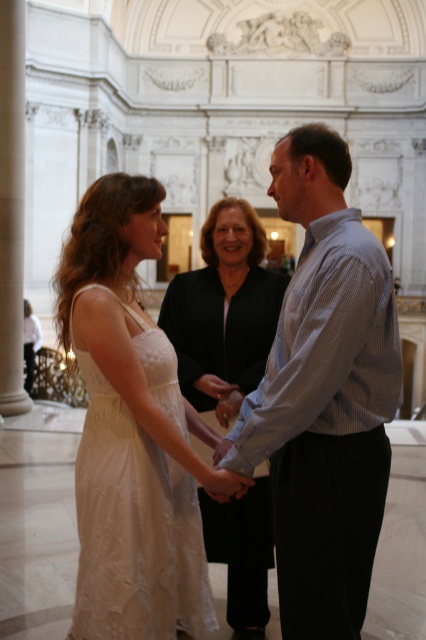
Question: Which of the following is the closest to the observer?

Choices:
 (A) matte black dress at center
 (B) blue striped shirt at center

Answer: (B)

Question: Considering the relative positions of white lace dress at center and matte black dress at center in the image provided, where is white lace dress at center located with respect to matte black dress at center?

Choices:
 (A) left
 (B) right

Answer: (A)

Question: Where is blue striped shirt at center located in relation to matte black dress at center in the image?

Choices:
 (A) left
 (B) right

Answer: (B)

Question: Which of these objects is positioned farthest from the blue striped shirt at center?

Choices:
 (A) matte black dress at center
 (B) white lace dress at center

Answer: (A)

Question: Which object is positioned closest to the white lace dress at center?

Choices:
 (A) matte black dress at center
 (B) blue striped shirt at center

Answer: (B)

Question: Observing the image, what is the correct spatial positioning of blue striped shirt at center in reference to white lace dress at center?

Choices:
 (A) below
 (B) above

Answer: (B)